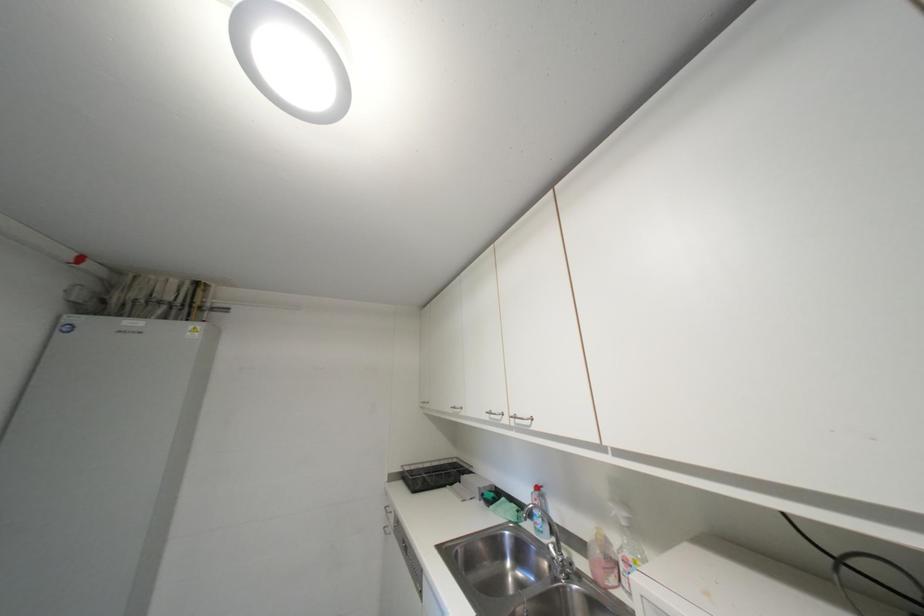
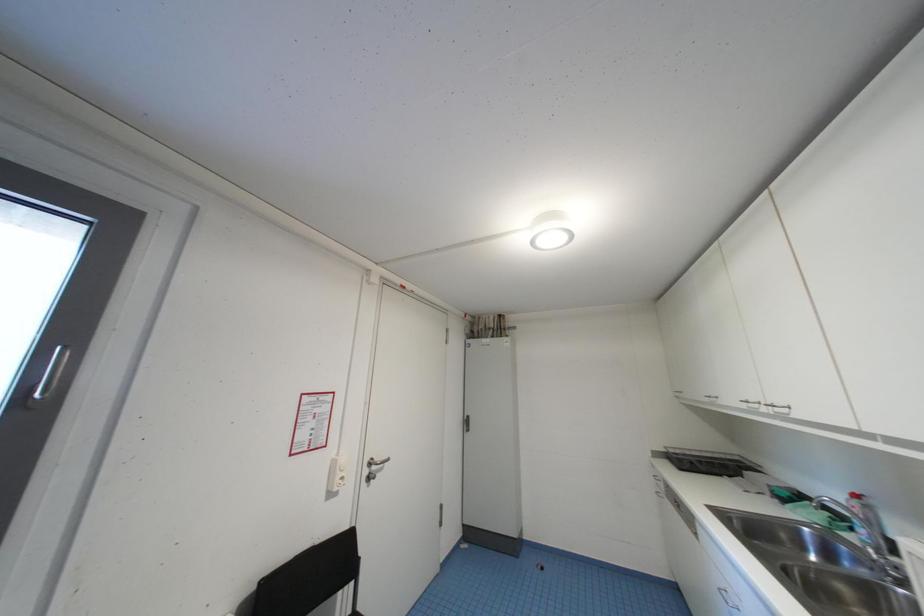
Question: The images are taken continuously from a first-person perspective. In which direction is your viewpoint rotating?

Choices:
 (A) Left
 (B) Right
 (C) Up
 (D) Down

Answer: (A)